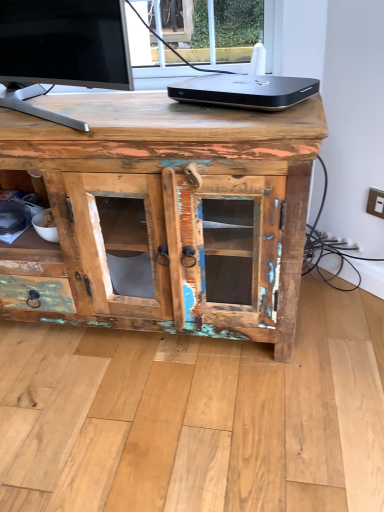
Question: Considering the relative positions of black metallic device at upper center and metallic beige switch at upper right in the image provided, is black metallic device at upper center to the left or to the right of metallic beige switch at upper right?

Choices:
 (A) left
 (B) right

Answer: (A)

Question: In the image, is black metallic device at upper center positioned in front of or behind metallic beige switch at upper right?

Choices:
 (A) front
 (B) behind

Answer: (A)

Question: Which of these objects is positioned closest to the rustic wood cabinet at center?

Choices:
 (A) metallic beige switch at upper right
 (B) black metallic device at upper center

Answer: (B)

Question: Which is farther from the black metallic device at upper center?

Choices:
 (A) metallic beige switch at upper right
 (B) rustic wood cabinet at center

Answer: (A)